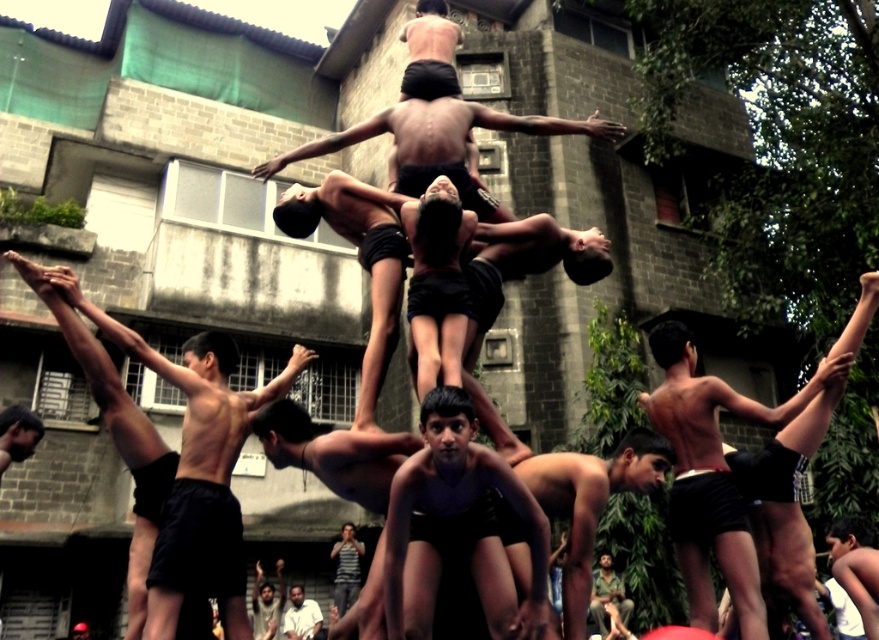
Question: Is dark skin human at center smaller than light skin human at center?

Choices:
 (A) yes
 (B) no

Answer: (A)

Question: Estimate the real-world distances between objects in this image. Which object is closer to the dark skin human at center?

Choices:
 (A) dark blue shorts at center
 (B) striped t-shirt at center

Answer: (B)

Question: Based on their relative distances, which object is nearer to the dark skin human at center?

Choices:
 (A) brown leather jacket at lower center
 (B) dark blue shorts at center

Answer: (A)

Question: Considering the relative positions of black matte shorts at center and dark skin human at center in the image provided, where is black matte shorts at center located with respect to dark skin human at center?

Choices:
 (A) above
 (B) below

Answer: (A)

Question: Which object is positioned farthest from the light skin human at center?

Choices:
 (A) dark skin human at center
 (B) striped t-shirt at center
 (C) brown leather jacket at lower center
 (D) black matte shorts at center

Answer: (D)

Question: Is the position of dark blue shorts at center more distant than that of dark skin human at center?

Choices:
 (A) yes
 (B) no

Answer: (B)